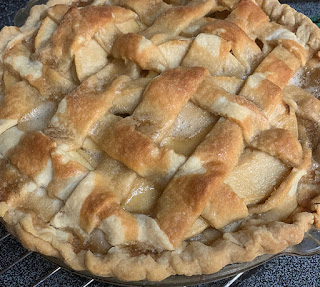
Identify the location of counter. (303, 261).